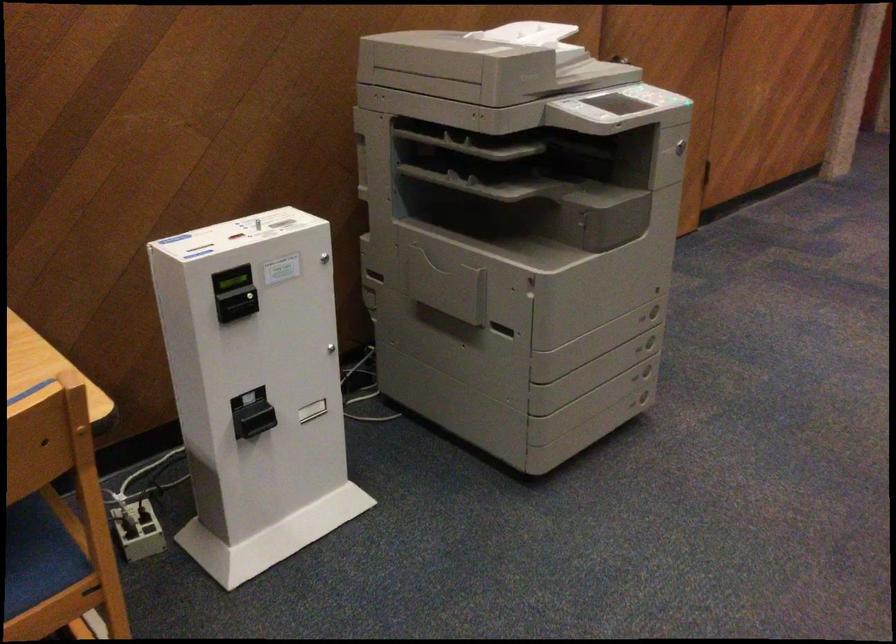
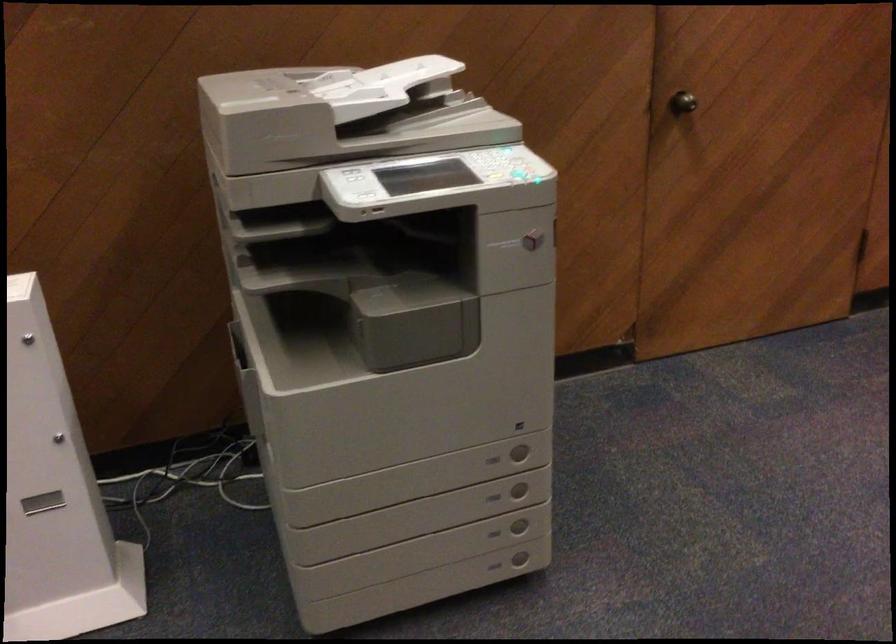
Where in the second image is the point corresponding to pixel 564 102 from the first image?

(354, 175)